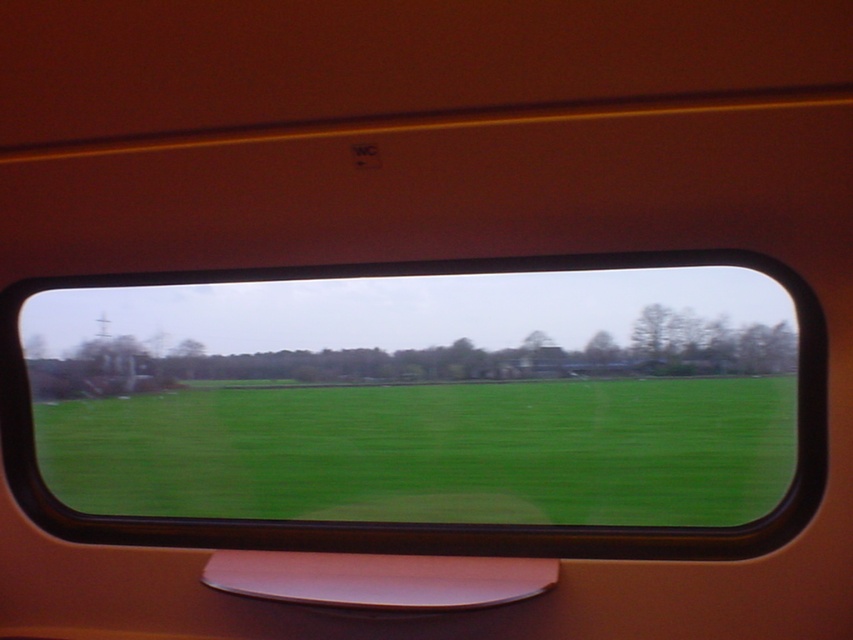
Which is more to the right, green matte field at center or green grass at center?

green grass at center

Looking at this image, does green matte field at center appear under green grass at center?

Incorrect, green matte field at center is not positioned below green grass at center.

At what (x,y) coordinates should I click in order to perform the action: click on green matte field at center. Please return your answer as a coordinate pair (x, y). Image resolution: width=853 pixels, height=640 pixels. Looking at the image, I should click on (422, 406).